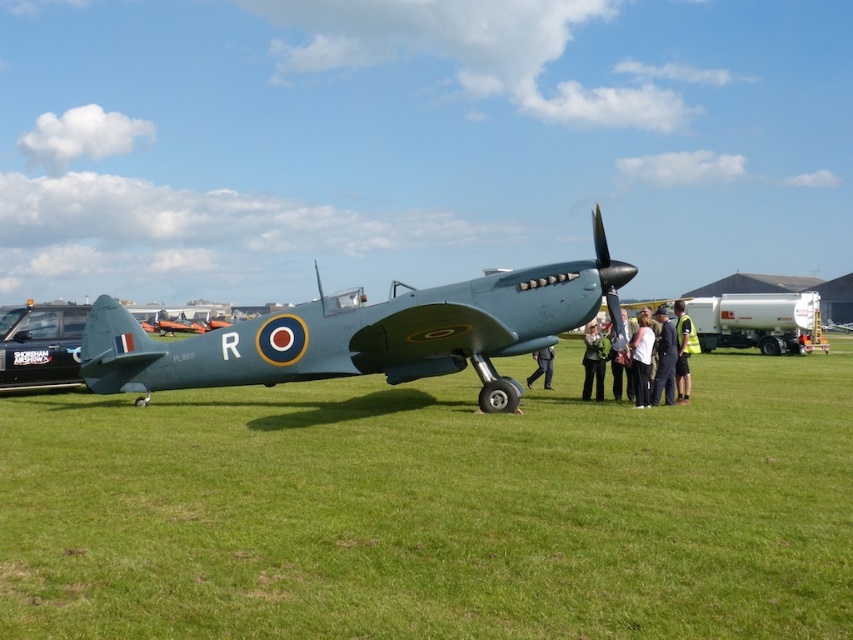
Which is more to the right, matte green airplane at center or yellow reflective vest at center?

Positioned to the right is yellow reflective vest at center.

Is matte green airplane at center to the left of yellow reflective vest at center from the viewer's perspective?

Indeed, matte green airplane at center is positioned on the left side of yellow reflective vest at center.

Is point (462, 312) positioned behind point (679, 301)?

No, it is in front of (679, 301).

Image resolution: width=853 pixels, height=640 pixels. Identify the location of matte green airplane at center. (364, 333).

Is leather jacket at center smaller than black fabric pants at lower center?

Actually, leather jacket at center might be larger than black fabric pants at lower center.

Does point (602, 342) lie behind point (544, 356)?

No, (602, 342) is closer to viewer.

Find the location of `leather jacket at center`. leather jacket at center is located at coordinates (593, 360).

Is dark blue uniform at center taller than leather jacket at center?

Yes, dark blue uniform at center is taller than leather jacket at center.

This screenshot has height=640, width=853. I want to click on dark blue uniform at center, so click(x=664, y=358).